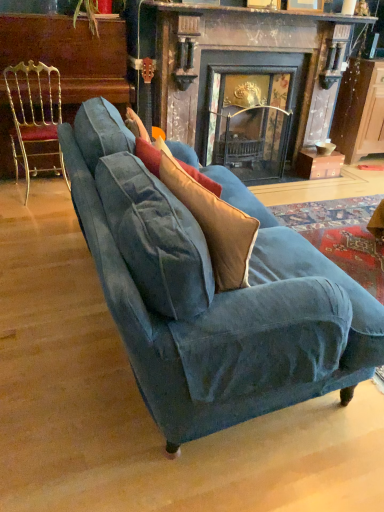
Question: Considering the relative sizes of dark wood fireplace at center and velvet beige throw pillow at center in the image provided, is dark wood fireplace at center bigger than velvet beige throw pillow at center?

Choices:
 (A) no
 (B) yes

Answer: (B)

Question: Considering the relative positions of dark wood fireplace at center and velvet beige throw pillow at center in the image provided, is dark wood fireplace at center to the right of velvet beige throw pillow at center from the viewer's perspective?

Choices:
 (A) yes
 (B) no

Answer: (A)

Question: Is dark wood fireplace at center at the left side of velvet beige throw pillow at center?

Choices:
 (A) no
 (B) yes

Answer: (A)

Question: Is dark wood fireplace at center positioned beyond the bounds of velvet beige throw pillow at center?

Choices:
 (A) yes
 (B) no

Answer: (A)

Question: Considering the relative sizes of dark wood fireplace at center and velvet beige throw pillow at center in the image provided, is dark wood fireplace at center wider than velvet beige throw pillow at center?

Choices:
 (A) no
 (B) yes

Answer: (B)

Question: From a real-world perspective, is dark wood fireplace at center on top of velvet beige throw pillow at center?

Choices:
 (A) no
 (B) yes

Answer: (A)

Question: Is wooden cabinet at right to the left of velvet blue couch at center from the viewer's perspective?

Choices:
 (A) no
 (B) yes

Answer: (A)

Question: From a real-world perspective, is wooden cabinet at right beneath velvet blue couch at center?

Choices:
 (A) yes
 (B) no

Answer: (B)

Question: Would you consider wooden cabinet at right to be distant from velvet blue couch at center?

Choices:
 (A) no
 (B) yes

Answer: (B)

Question: Is wooden cabinet at right in front of velvet blue couch at center?

Choices:
 (A) no
 (B) yes

Answer: (A)

Question: Is wooden cabinet at right thinner than velvet blue couch at center?

Choices:
 (A) no
 (B) yes

Answer: (B)

Question: Considering the relative sizes of wooden cabinet at right and velvet blue couch at center in the image provided, is wooden cabinet at right taller than velvet blue couch at center?

Choices:
 (A) yes
 (B) no

Answer: (A)

Question: Does gold metallic chair at left appear on the right side of velvet blue couch at center?

Choices:
 (A) yes
 (B) no

Answer: (B)